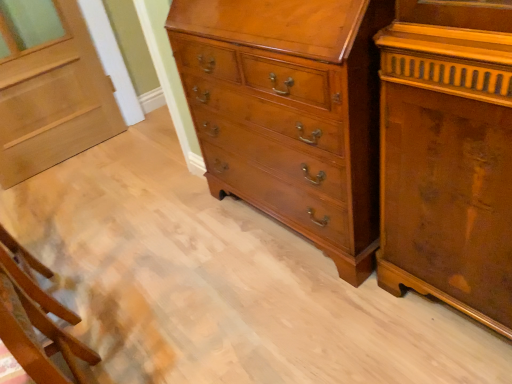
Describe the element at coordinates (289, 112) in the screenshot. I see `glossy wood chest of drawers at center` at that location.

Where is `light brown wood door at upper left`? light brown wood door at upper left is located at coordinates (51, 96).

This screenshot has height=384, width=512. Describe the element at coordinates (35, 318) in the screenshot. I see `wooden chair at lower left` at that location.

The height and width of the screenshot is (384, 512). Identify the location of glossy wood chest of drawers at center. (289, 112).

Based on the photo, considering the sizes of objects light brown wood door at upper left and glossy wood chest of drawers at center in the image provided, who is shorter, light brown wood door at upper left or glossy wood chest of drawers at center?

Standing shorter between the two is light brown wood door at upper left.

From the picture: Which object is positioned more to the right, light brown wood door at upper left or glossy wood chest of drawers at center?

glossy wood chest of drawers at center is more to the right.

From a real-world perspective, which is physically below, light brown wood door at upper left or glossy wood chest of drawers at center?

light brown wood door at upper left is physically lower.

At what (x,y) coordinates should I click in order to perform the action: click on the chest of drawers located below the light brown wood door at upper left (from the image's perspective). Please return your answer as a coordinate pair (x, y). This screenshot has height=384, width=512. Looking at the image, I should click on (289, 112).

From the image's perspective, is glossy wood chest of drawers at center above or below light brown wood door at upper left?

From the image's perspective, glossy wood chest of drawers at center appears below light brown wood door at upper left.

Looking at this image, considering the sizes of glossy wood chest of drawers at center and light brown wood door at upper left in the image, is glossy wood chest of drawers at center wider or thinner than light brown wood door at upper left?

In the image, glossy wood chest of drawers at center appears to be wider than light brown wood door at upper left.

Where is `the chest of drawers that appears below the light brown wood door at upper left (from the image's perspective)`? The image size is (512, 384). the chest of drawers that appears below the light brown wood door at upper left (from the image's perspective) is located at coordinates (289, 112).

Is wooden chair at lower left next to glossy wood chest of drawers at center and touching it?

wooden chair at lower left and glossy wood chest of drawers at center are not in contact.

In the image, there is a glossy wood chest of drawers at center. Where is `furniture below it (from the image's perspective)`? Image resolution: width=512 pixels, height=384 pixels. furniture below it (from the image's perspective) is located at coordinates (35, 318).

Who is bigger, wooden chair at lower left or glossy wood chest of drawers at center?

With larger size is glossy wood chest of drawers at center.

Considering the positions of points (52, 369) and (36, 10), is point (52, 369) closer to camera compared to point (36, 10)?

Yes, it is in front of point (36, 10).

Is wooden chair at lower left positioned before light brown wood door at upper left?

Yes, it is in front of light brown wood door at upper left.

Is light brown wood door at upper left located within wooden chair at lower left?

No, light brown wood door at upper left is located outside of wooden chair at lower left.

Is wooden chair at lower left not near light brown wood door at upper left?

wooden chair at lower left is positioned a significant distance from light brown wood door at upper left.

In the scene shown: Is there a large distance between glossy wood chest of drawers at center and wooden chair at lower left?

They are positioned close to each other.

Does point (387, 5) appear closer or farther from the camera than point (7, 282)?

Clearly, point (387, 5) is closer to the camera than point (7, 282).

From the image's perspective, which is above, glossy wood chest of drawers at center or wooden chair at lower left?

glossy wood chest of drawers at center, from the image's perspective.

Considering the sizes of glossy wood chest of drawers at center and wooden chair at lower left in the image, is glossy wood chest of drawers at center wider or thinner than wooden chair at lower left?

In the image, glossy wood chest of drawers at center appears to be wider than wooden chair at lower left.

Considering the sizes of objects light brown wood door at upper left and wooden chair at lower left in the image provided, who is taller, light brown wood door at upper left or wooden chair at lower left?

Standing taller between the two is light brown wood door at upper left.

Which of these two, light brown wood door at upper left or wooden chair at lower left, is bigger?

With larger size is wooden chair at lower left.

Is light brown wood door at upper left placed right next to wooden chair at lower left?

No, light brown wood door at upper left is not touching wooden chair at lower left.

This screenshot has width=512, height=384. Find the location of `door that appears above the glossy wood chest of drawers at center (from the image's perspective)`. door that appears above the glossy wood chest of drawers at center (from the image's perspective) is located at coordinates (51, 96).

Locate an element on the screen. chest of drawers on the right of light brown wood door at upper left is located at coordinates (289, 112).

Estimate the real-world distances between objects in this image. Which object is further from light brown wood door at upper left, wooden chair at lower left or glossy wood chest of drawers at center?

glossy wood chest of drawers at center.

Which object lies further to the anchor point wooden chair at lower left, glossy wood chest of drawers at center or light brown wood door at upper left?

Based on the image, light brown wood door at upper left appears to be further to wooden chair at lower left.

Considering their positions, is light brown wood door at upper left positioned closer to wooden chair at lower left than glossy wood chest of drawers at center?

Among the two, glossy wood chest of drawers at center is located nearer to wooden chair at lower left.

Based on their spatial positions, is light brown wood door at upper left or wooden chair at lower left further from glossy wood chest of drawers at center?

Based on the image, light brown wood door at upper left appears to be further to glossy wood chest of drawers at center.

Which object lies further to the anchor point glossy wood chest of drawers at center, wooden chair at lower left or light brown wood door at upper left?

Among the two, light brown wood door at upper left is located further to glossy wood chest of drawers at center.

Based on their spatial positions, is glossy wood chest of drawers at center or wooden chair at lower left closer to light brown wood door at upper left?

Among the two, wooden chair at lower left is located nearer to light brown wood door at upper left.

Where is `the chest of drawers positioned between wooden chair at lower left and light brown wood door at upper left from near to far`? the chest of drawers positioned between wooden chair at lower left and light brown wood door at upper left from near to far is located at coordinates pyautogui.click(x=289, y=112).